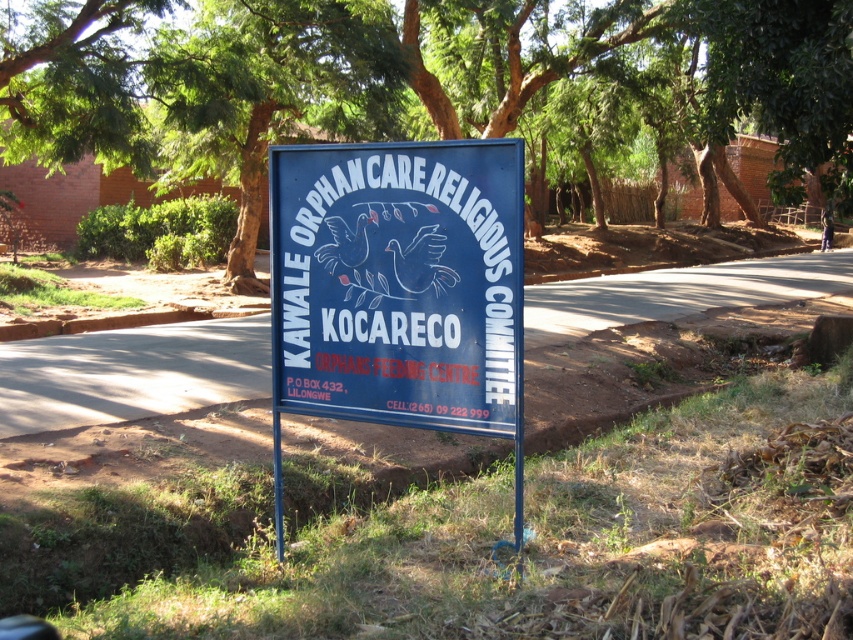
Does green leafy tree at upper center come behind blue painted metal signboard at center?

Yes, green leafy tree at upper center is further from the viewer.

This screenshot has height=640, width=853. Identify the location of green leafy tree at upper center. (375, 67).